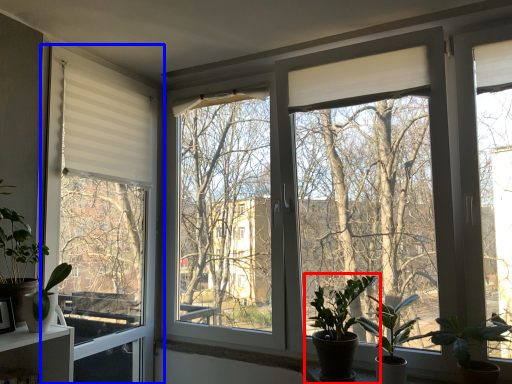
Question: Which object appears closest to the camera in this image, houseplant (highlighted by a red box) or window (highlighted by a blue box)?

Choices:
 (A) houseplant
 (B) window

Answer: (A)